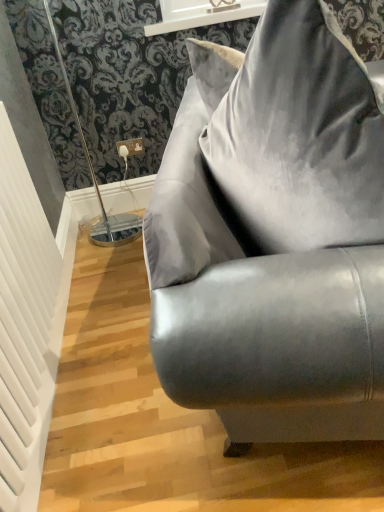
Question: Considering the positions of white glossy window sill at upper center and satin gray couch at center in the image, is white glossy window sill at upper center taller or shorter than satin gray couch at center?

Choices:
 (A) tall
 (B) short

Answer: (B)

Question: Choose the correct answer: Is white glossy window sill at upper center inside satin gray couch at center or outside it?

Choices:
 (A) inside
 (B) outside

Answer: (B)

Question: Based on their relative distances, which object is farther from the satin gray couch at center?

Choices:
 (A) white glossy window sill at upper center
 (B) white textured radiator at left

Answer: (A)

Question: Estimate the real-world distances between objects in this image. Which object is farther from the white textured radiator at left?

Choices:
 (A) satin gray couch at center
 (B) white glossy window sill at upper center

Answer: (B)